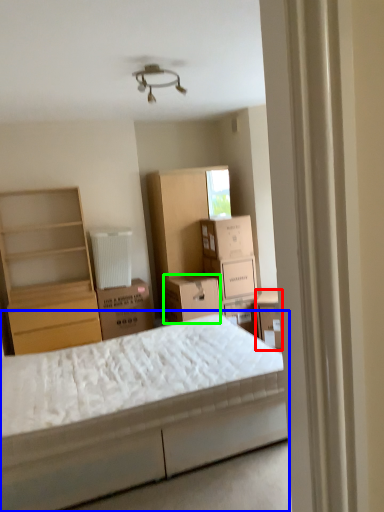
Question: Based on their relative distances, which object is farther from storage box (highlighted by a red box)? Choose from bed (highlighted by a blue box) and storage box (highlighted by a green box).

Choices:
 (A) bed
 (B) storage box

Answer: (A)